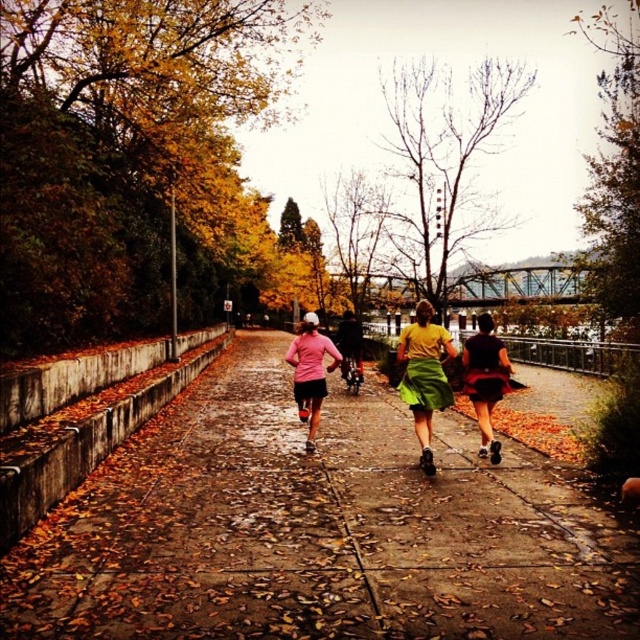
Question: Which point is closer to the camera?

Choices:
 (A) matte black shorts at center
 (B) pink matte shirt at center
 (C) yellow matte shirt at center
 (D) concrete at center

Answer: (D)

Question: Which object is the farthest from the matte black shorts at center?

Choices:
 (A) concrete at center
 (B) yellow matte shirt at center
 (C) pink matte shirt at center

Answer: (C)

Question: Can you confirm if yellow matte shirt at center is bigger than pink matte shirt at center?

Choices:
 (A) yes
 (B) no

Answer: (B)

Question: Which of the following is the closest to the observer?

Choices:
 (A) concrete at center
 (B) yellow matte shirt at center
 (C) pink matte shirt at center

Answer: (A)

Question: Is concrete at center positioned in front of pink matte shirt at center?

Choices:
 (A) no
 (B) yes

Answer: (B)

Question: Does concrete at center have a smaller size compared to matte black shorts at center?

Choices:
 (A) yes
 (B) no

Answer: (B)